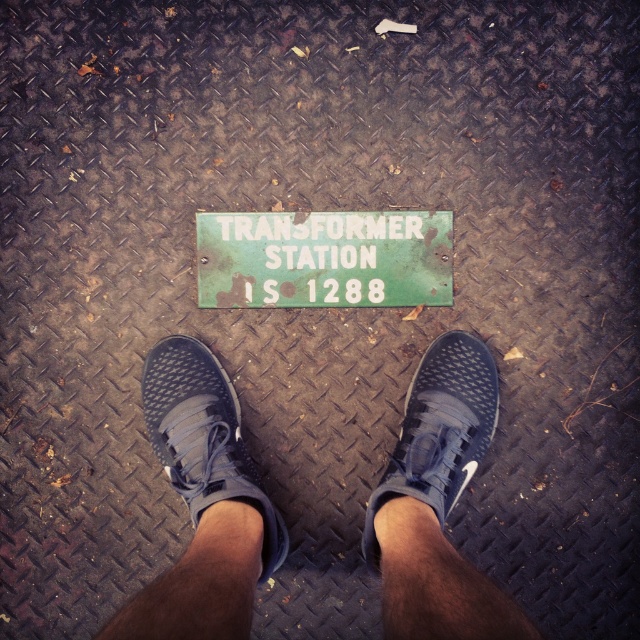
Can you confirm if blue mesh sneakers at center is shorter than green rusted sign at center?

No.

Which is more to the left, blue mesh sneakers at center or green rusted sign at center?

From the viewer's perspective, blue mesh sneakers at center appears more on the left side.

The image size is (640, 640). What are the coordinates of `blue mesh sneakers at center` in the screenshot? It's located at (202, 504).

Is matte blue sneaker at center positioned before black mesh shoe at center?

Yes, it is.

Is point (269, 531) in front of point (470, 339)?

That is True.

Between point (257, 497) and point (417, 397), which one is positioned in front?

Point (257, 497) is more forward.

Image resolution: width=640 pixels, height=640 pixels. In order to click on matte blue sneaker at center in this screenshot , I will do `click(204, 436)`.

The height and width of the screenshot is (640, 640). Describe the element at coordinates (323, 259) in the screenshot. I see `green rusted sign at center` at that location.

Is green rusted sign at center positioned before black mesh shoe at center?

That is False.

Where is `green rusted sign at center`? The image size is (640, 640). green rusted sign at center is located at coordinates 323,259.

The height and width of the screenshot is (640, 640). I want to click on green rusted sign at center, so click(323, 259).